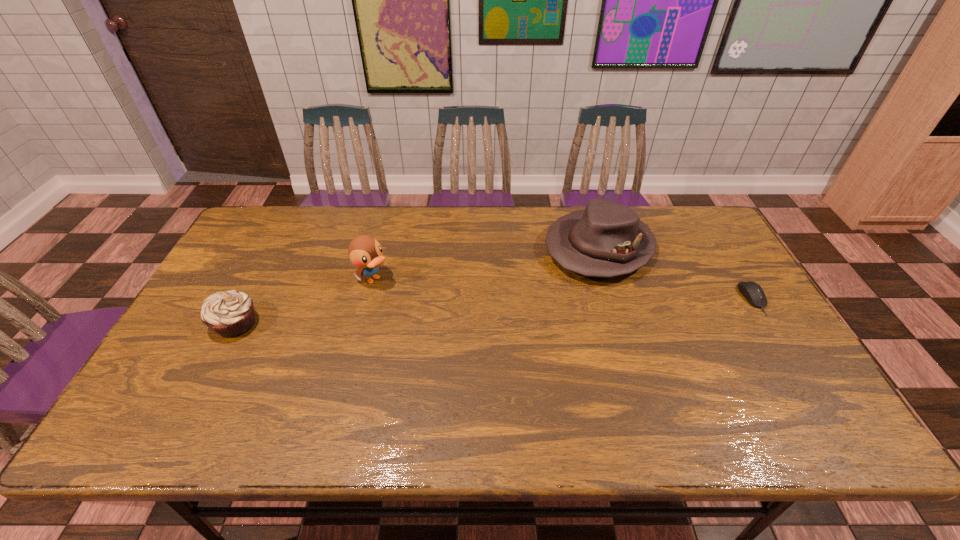
The image size is (960, 540). I want to click on the leftmost object, so click(x=230, y=314).

Where is `the second shortest object`? This screenshot has height=540, width=960. the second shortest object is located at coordinates (230, 314).

This screenshot has width=960, height=540. In order to click on computer mouse in this screenshot , I will do `click(754, 294)`.

Identify the location of the rightmost object. The image size is (960, 540). (754, 294).

The height and width of the screenshot is (540, 960). Identify the location of hat. (607, 239).

Where is `the third object from right to left`? The height and width of the screenshot is (540, 960). the third object from right to left is located at coordinates (365, 252).

Locate an element on the screen. The height and width of the screenshot is (540, 960). vacant point located 0.270m on the back of the third tallest object is located at coordinates (276, 245).

Locate an element on the screen. The width and height of the screenshot is (960, 540). blank space located on the back of the shortest object is located at coordinates (707, 222).

Locate an element on the screen. The image size is (960, 540). free space located on the decorative side of the third object from left to right is located at coordinates (528, 305).

Locate an element on the screen. The width and height of the screenshot is (960, 540). free space located on the decorative side of the third object from left to right is located at coordinates (550, 287).